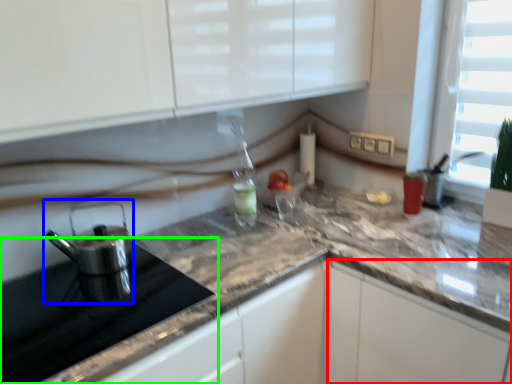
Question: Which is nearer to the cabinetry (highlighted by a red box)? kitchen appliance (highlighted by a blue box) or appliance (highlighted by a green box).

Choices:
 (A) kitchen appliance
 (B) appliance

Answer: (B)